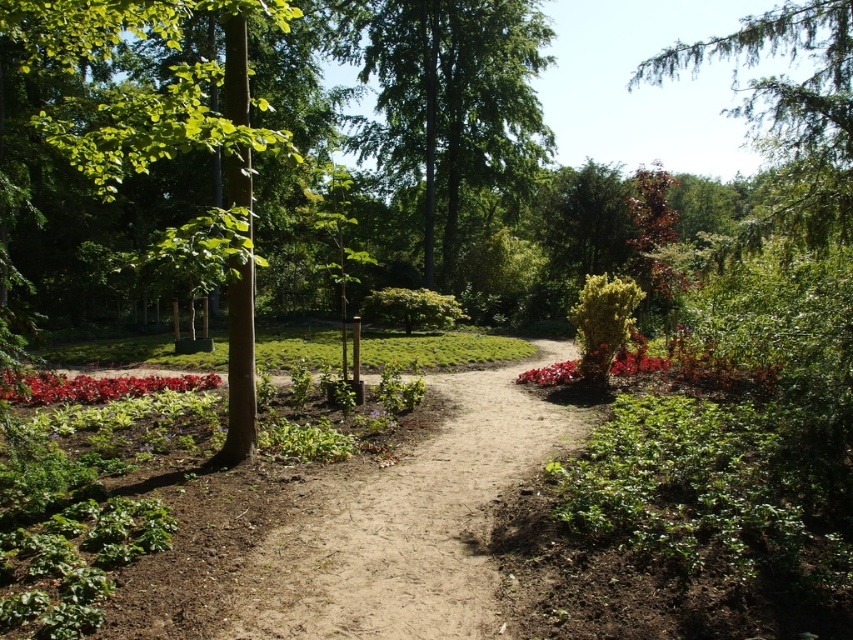
Question: Based on their relative distances, which object is nearer to the red matte flower at center-right?

Choices:
 (A) green leafy tree at center
 (B) red matte flower bed at lower left

Answer: (B)

Question: Which point is farther to the camera?

Choices:
 (A) green leafy bush at center
 (B) red matte flower bed at lower left
 (C) green textured tree at upper right
 (D) red matte flower at center-right

Answer: (A)

Question: Which point is closer to the camera?

Choices:
 (A) (79, 397)
 (B) (445, 307)
 (C) (805, 237)

Answer: (C)

Question: Can you confirm if red matte flower bed at lower left is wider than green leafy bush at center?

Choices:
 (A) no
 (B) yes

Answer: (A)

Question: Can you confirm if green leafy tree at center is wider than green leafy bush at center?

Choices:
 (A) yes
 (B) no

Answer: (A)

Question: Can you confirm if dirt path at center is positioned to the left of red matte flower bed at lower left?

Choices:
 (A) no
 (B) yes

Answer: (A)